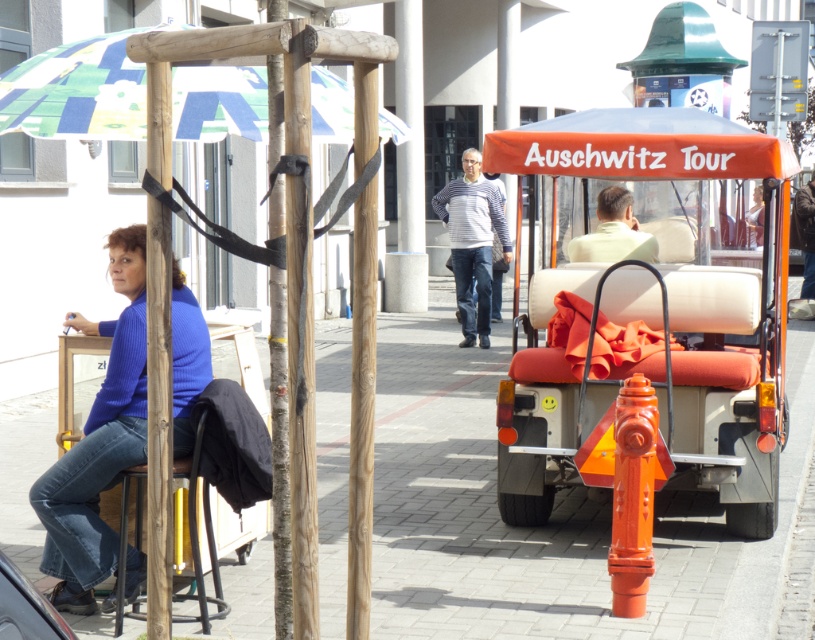
Is smooth concrete pavement at center above printed fabric umbrella at upper left?

Incorrect, smooth concrete pavement at center is not positioned above printed fabric umbrella at upper left.

Does point (399, 568) lie in front of point (120, 132)?

No, it is not.

Find the location of a particular element. smooth concrete pavement at center is located at coordinates (549, 518).

The width and height of the screenshot is (815, 640). What are the coordinates of `smooth concrete pavement at center` in the screenshot? It's located at (549, 518).

Is blue sweater at left wider than light green fabric at rear center?

Yes.

Locate an element on the screen. The height and width of the screenshot is (640, 815). blue sweater at left is located at coordinates (98, 440).

Where is `blue sweater at left`? Image resolution: width=815 pixels, height=640 pixels. blue sweater at left is located at coordinates (98, 440).

Where is `blue sweater at left`? blue sweater at left is located at coordinates (98, 440).

Locate an element on the screen. orange fabric golf cart at right is located at coordinates click(655, 307).

Does orange fabric golf cart at right have a smaller size compared to orange matte fire hydrant at lower right?

Incorrect, orange fabric golf cart at right is not smaller in size than orange matte fire hydrant at lower right.

Image resolution: width=815 pixels, height=640 pixels. I want to click on orange fabric golf cart at right, so click(x=655, y=307).

Locate an element on the screen. orange fabric golf cart at right is located at coordinates (655, 307).